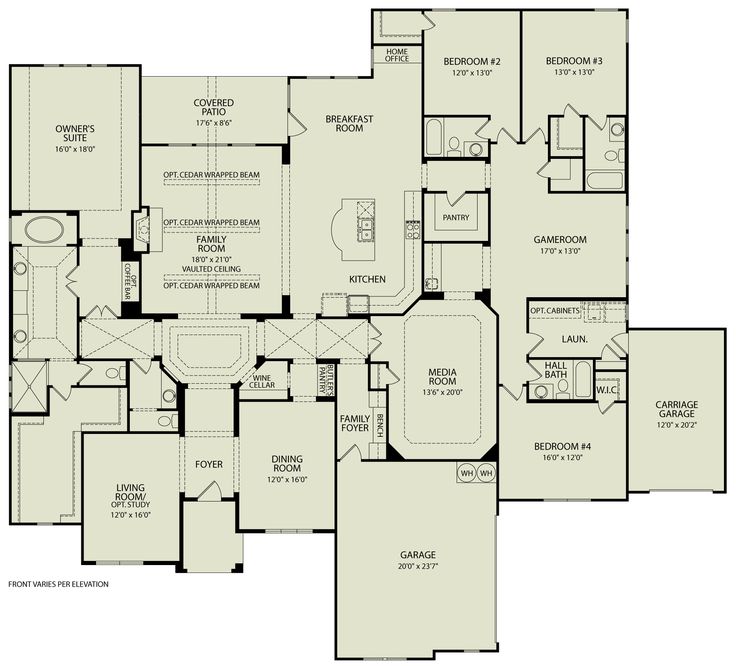
This screenshot has height=666, width=736. Identify the location of sinks. (542, 393), (618, 129), (477, 147), (367, 230), (23, 335), (23, 264), (169, 397).